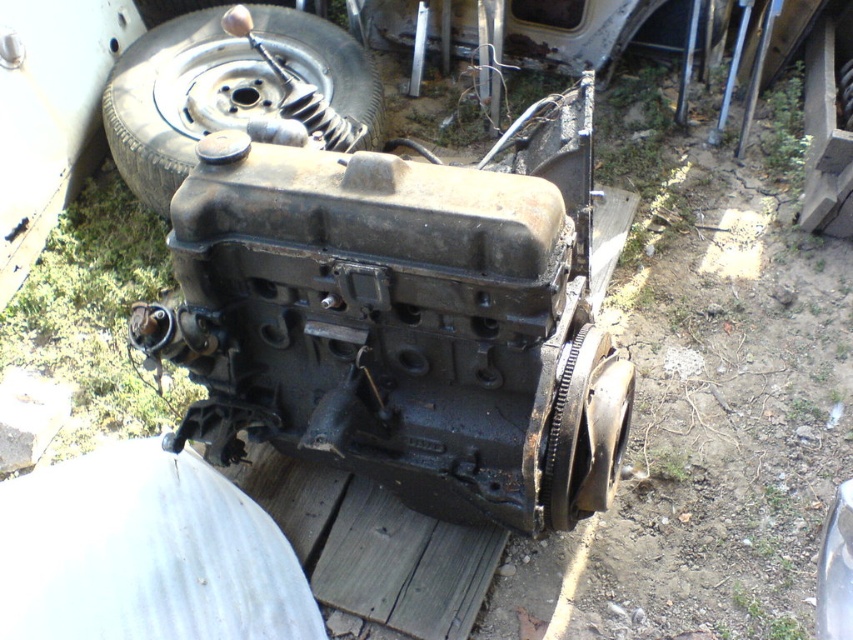
You are a mechanic working on an engine repair. You need to move the black rubber tire at upper left to access the rusty metal engine at center. Based on their sizes, which object should you move first to ensure there is enough space?

The rusty metal engine at center is taller than the black rubber tire at upper left, so you should move the black rubber tire at upper left first to create space for the engine.

You are an engineer inspecting the engine. You notice a specific point at coordinates point (403, 317). Where exactly is this point located?

The point (403, 317) is located on the rusty metal engine at center.

You are a mechanic working on an engine repair. You need to move the rusty metal engine at center and the black rubber tire at upper left to make space for a new part. Which object should you move first to free up more space?

You should move the rusty metal engine at center first because it occupies less space than the black rubber tire at upper left, so moving it first would free up more space.